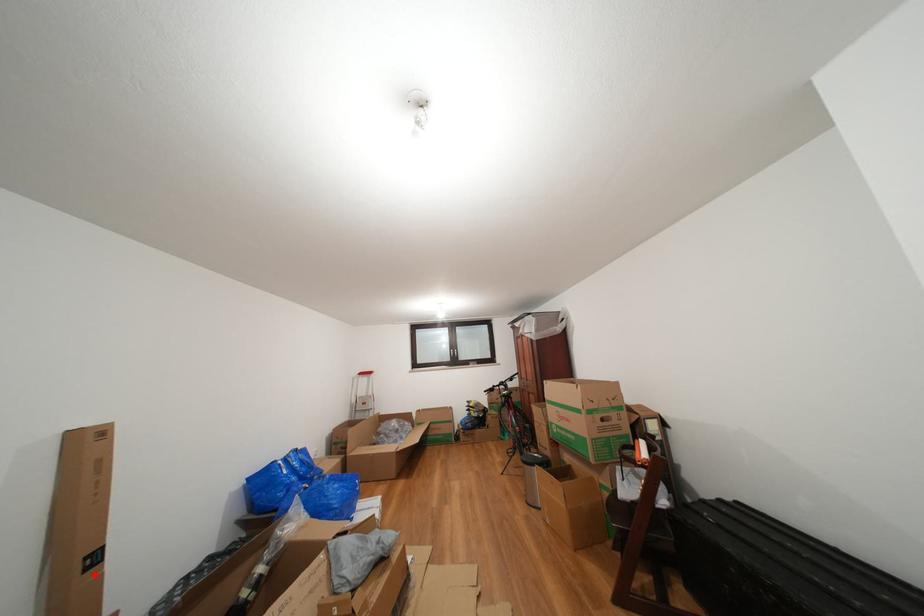
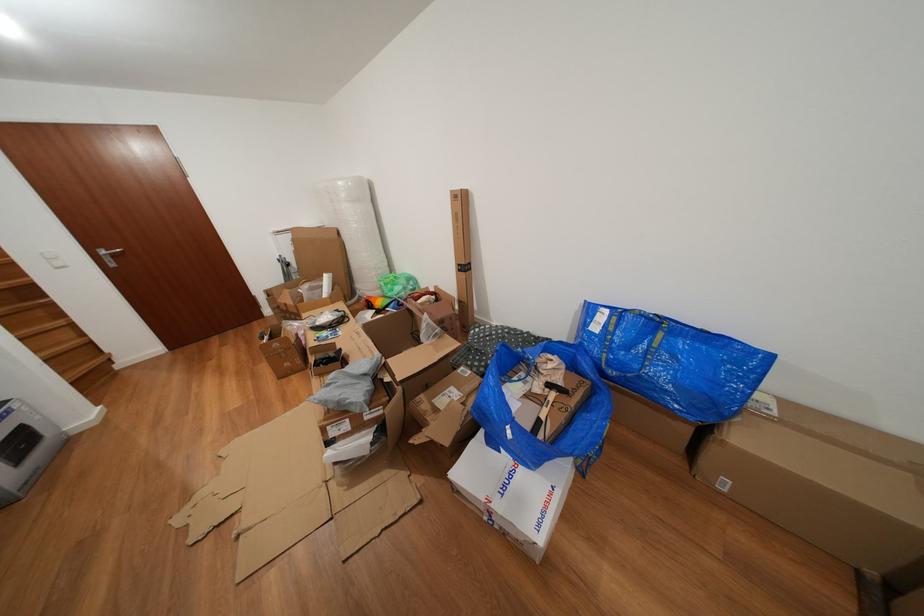
Question: I am providing you with two images of the same scene from different viewpoints. A red point is shown in image1. For the corresponding object point in image2, is it positioned nearer or farther from the camera?

Choices:
 (A) Nearer
 (B) Farther

Answer: (A)